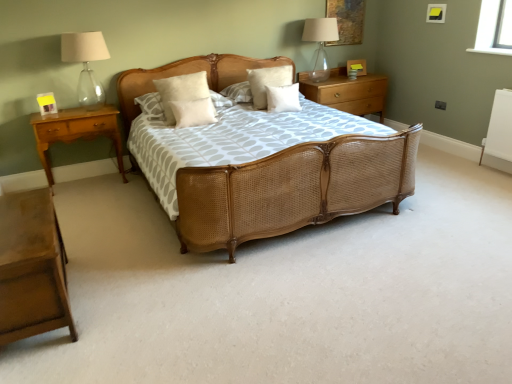
Where is `blank space above light brown wood nightstand at left, placed as the second nightstand when sorted from top to bottom (from a real-world perspective)`? The image size is (512, 384). blank space above light brown wood nightstand at left, placed as the second nightstand when sorted from top to bottom (from a real-world perspective) is located at coordinates (80, 110).